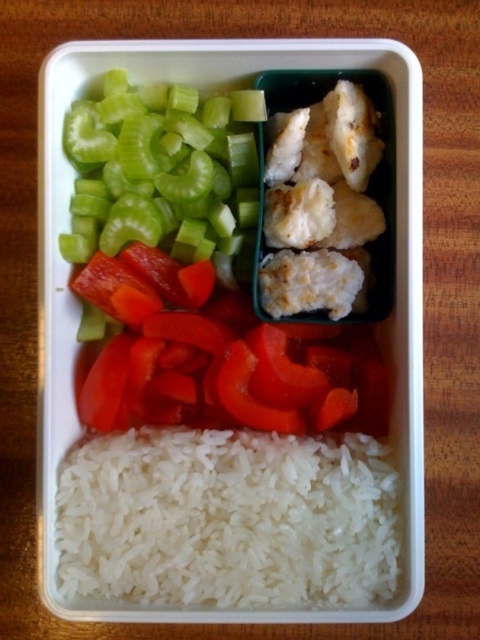
You are looking at the image of a meal in a container. There are two points marked in the image. The first point is at coordinate point (345,477) and the second is at point (86,218). Which of these two points is closer to you?

Point (345,477) is closer to the viewer than point (86,218).

You are a food stylist arranging a meal in a white rectangular container. You have the white matte rice at bottom and the green crisp celery at upper left. Which component takes up more space in the container?

The white matte rice at bottom takes up more space in the container because it is larger in size than the green crisp celery at upper left.